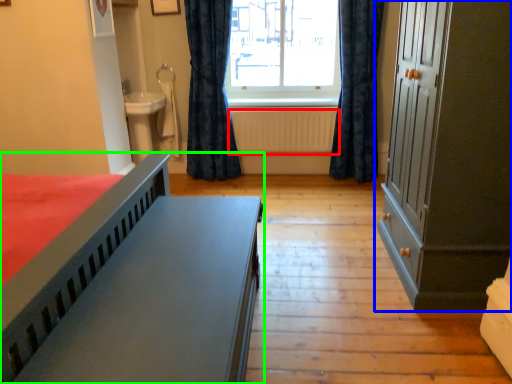
Question: Which object is the farthest from radiator (highlighted by a red box)? Choose among these: cupboard (highlighted by a blue box) or bed (highlighted by a green box).

Choices:
 (A) cupboard
 (B) bed

Answer: (B)